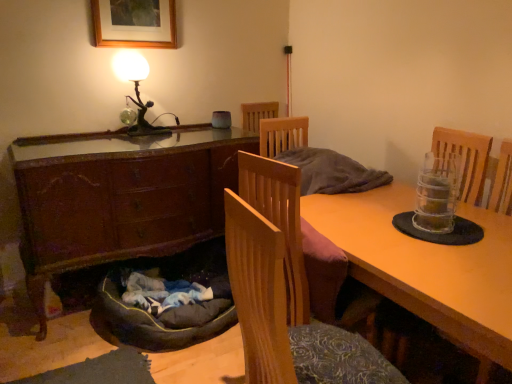
Question: Is wooden picture frame at upper center taller or shorter than wooden chair at center?

Choices:
 (A) short
 (B) tall

Answer: (A)

Question: Considering their positions, is wooden picture frame at upper center located in front of or behind wooden chair at center?

Choices:
 (A) front
 (B) behind

Answer: (B)

Question: Estimate the real-world distances between objects in this image. Which object is farther from the wooden desk at center?

Choices:
 (A) wooden picture frame at upper center
 (B) wooden cabinet at lower left
 (C) dark gray fabric dog bed at lower left
 (D) metallic figure at upper left
 (E) wooden chair at center

Answer: (A)

Question: Which is nearer to the wooden chair at center?

Choices:
 (A) dark gray fabric dog bed at lower left
 (B) metallic figure at upper left
 (C) wooden picture frame at upper center
 (D) wooden cabinet at lower left
 (E) wooden desk at center

Answer: (E)